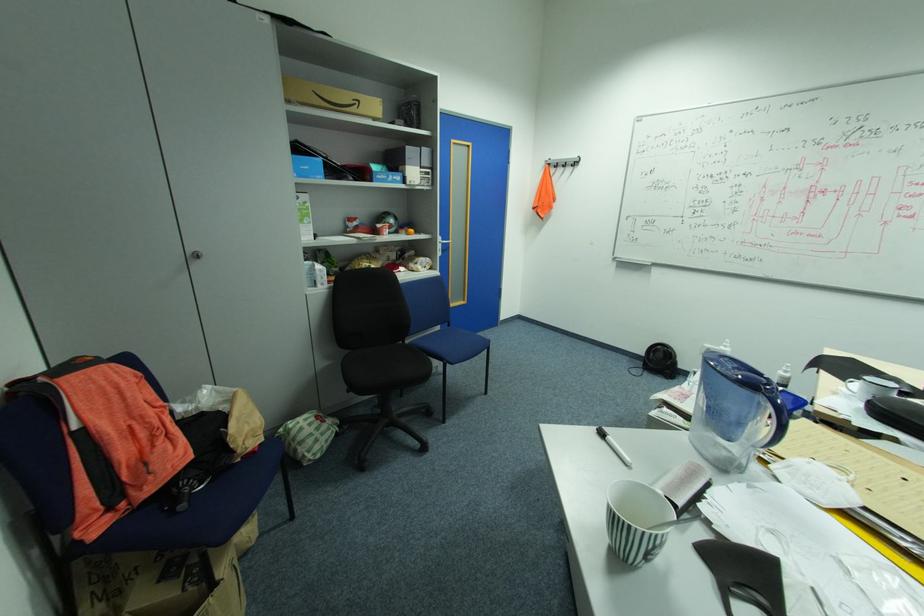
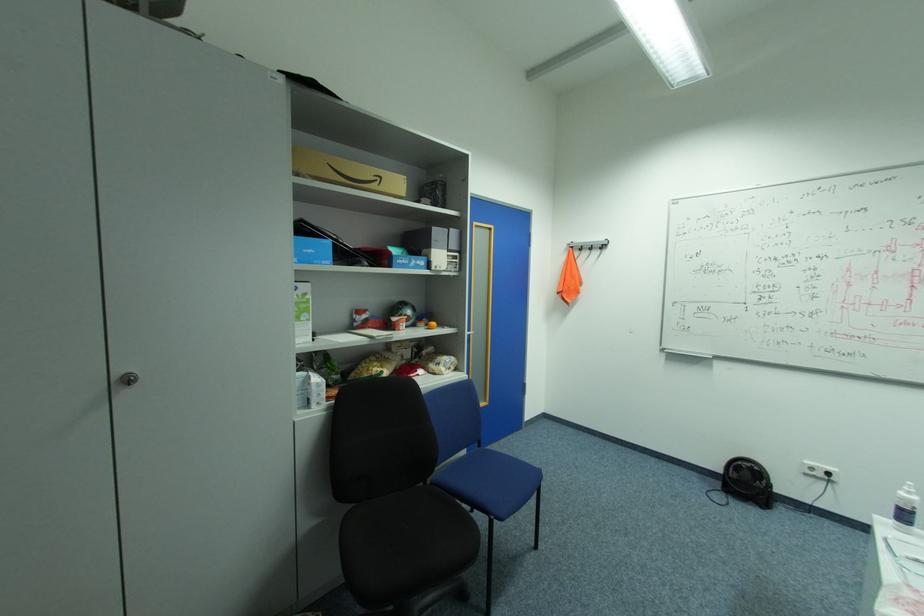
Locate, in the second image, the point that corresponds to [203,256] in the first image.

(137, 379)